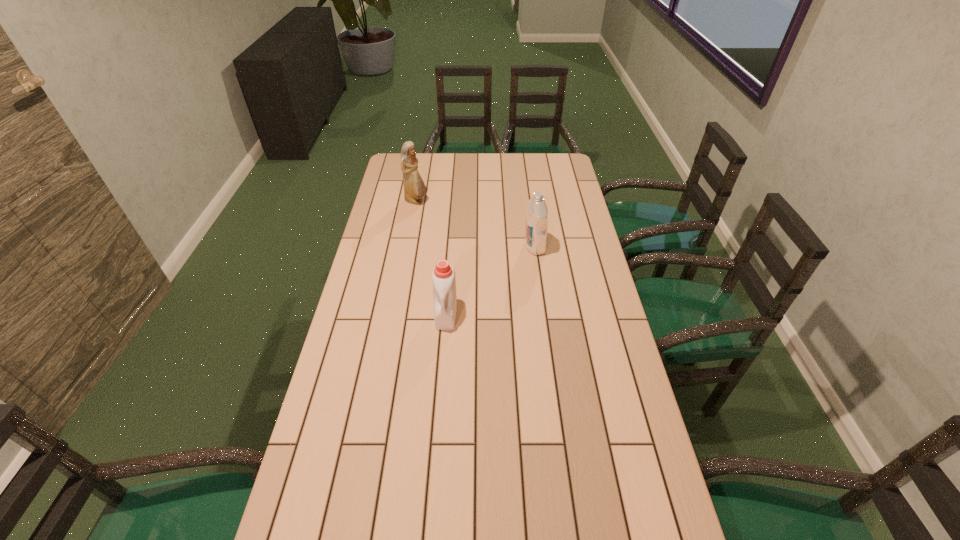
Find the location of a particular element. This screenshot has width=960, height=540. vacant region at the left edge of the desktop is located at coordinates (388, 312).

Identify the location of vacant position at the right edge of the desktop. The width and height of the screenshot is (960, 540). (591, 361).

You are a GUI agent. You are given a task and a screenshot of the screen. Output one action in this format:
    pyautogui.click(x=<x>, y=<y>)
    Task: Click on the vacant area at the far left corner
    The height and width of the screenshot is (540, 960).
    Given the screenshot: What is the action you would take?
    pyautogui.click(x=403, y=176)

This screenshot has width=960, height=540. In the image, there is a desktop. What are the coordinates of `free space at the far right corner` in the screenshot? It's located at (555, 164).

Locate an element on the screen. free space between the figurine and the farther detergent is located at coordinates coord(475,224).

Locate an element on the screen. This screenshot has height=540, width=960. unoccupied area between the farthest object and the left detergent is located at coordinates (431, 258).

You are a GUI agent. You are given a task and a screenshot of the screen. Output one action in this format:
    pyautogui.click(x=<x>, y=<y>)
    Task: Click on the free area in between the right detergent and the second object from right to left
    This screenshot has width=960, height=540.
    Given the screenshot: What is the action you would take?
    pyautogui.click(x=491, y=280)

This screenshot has height=540, width=960. Find the location of `free space between the nearer detergent and the leftmost object`. free space between the nearer detergent and the leftmost object is located at coordinates (431, 258).

Identify the location of object that stands as the second closest to the second object from left to right. (414, 188).

Select which object is the closest to the rightmost object. Please provide its 2D coordinates. Your answer should be formatted as a tuple, i.e. [(x, y)], where the tuple contains the x and y coordinates of a point satisfying the conditions above.

[(443, 277)]